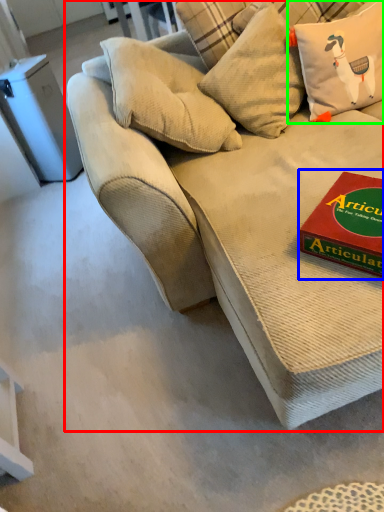
Question: Which object is the closest to the studio couch (highlighted by a red box)? Choose among these: paperback book (highlighted by a blue box) or pillow (highlighted by a green box).

Choices:
 (A) paperback book
 (B) pillow

Answer: (A)